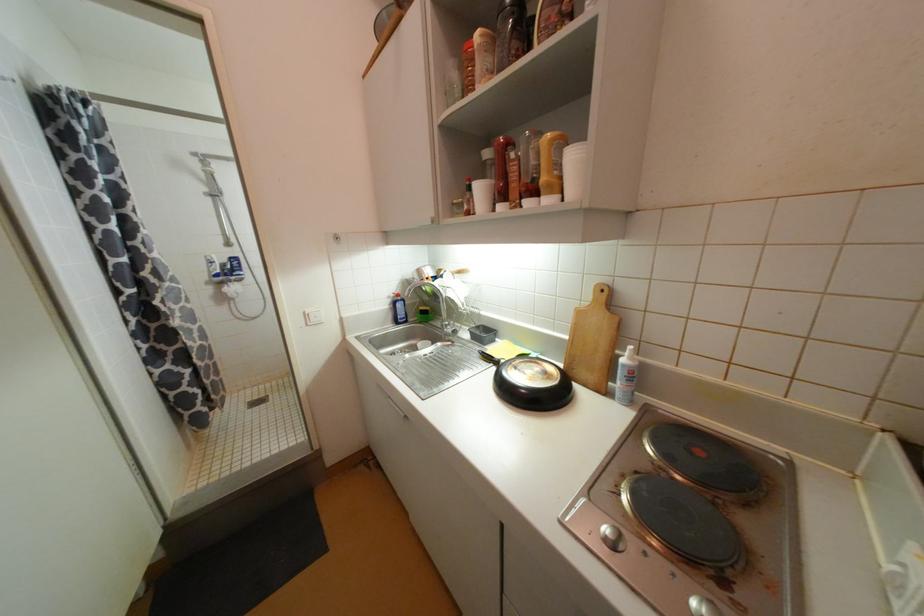
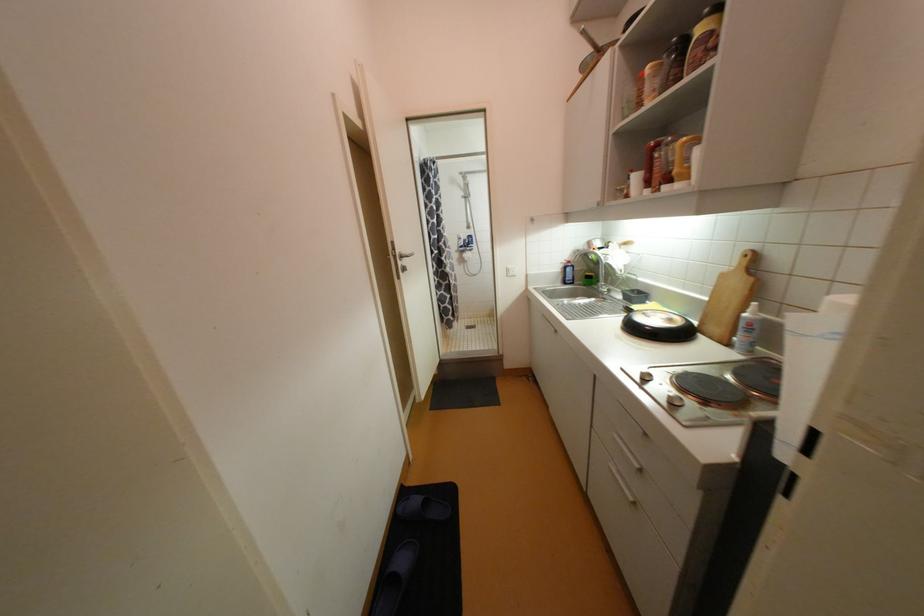
Where in the second image is the point corresponding to the point at 402,323 from the first image?

(569, 283)